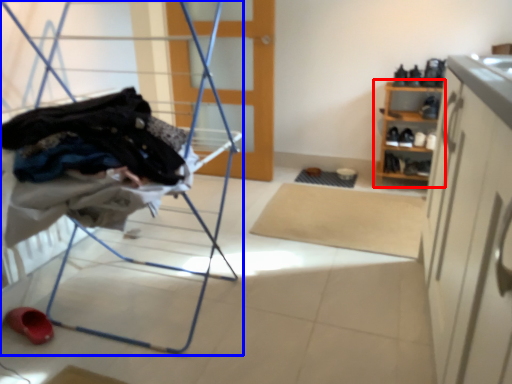
Question: Which object appears farthest to the camera in this image, shelf (highlighted by a red box) or furniture (highlighted by a blue box)?

Choices:
 (A) shelf
 (B) furniture

Answer: (A)